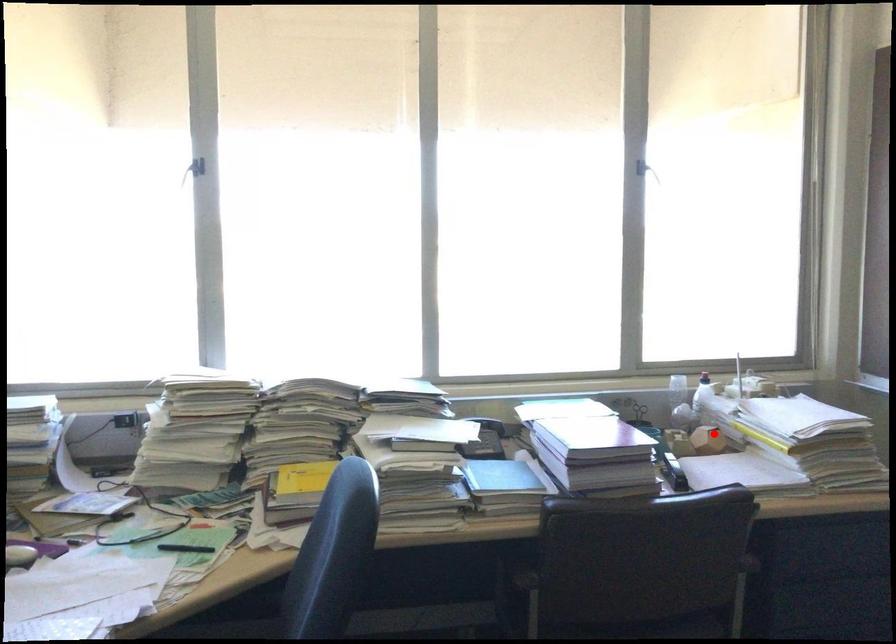
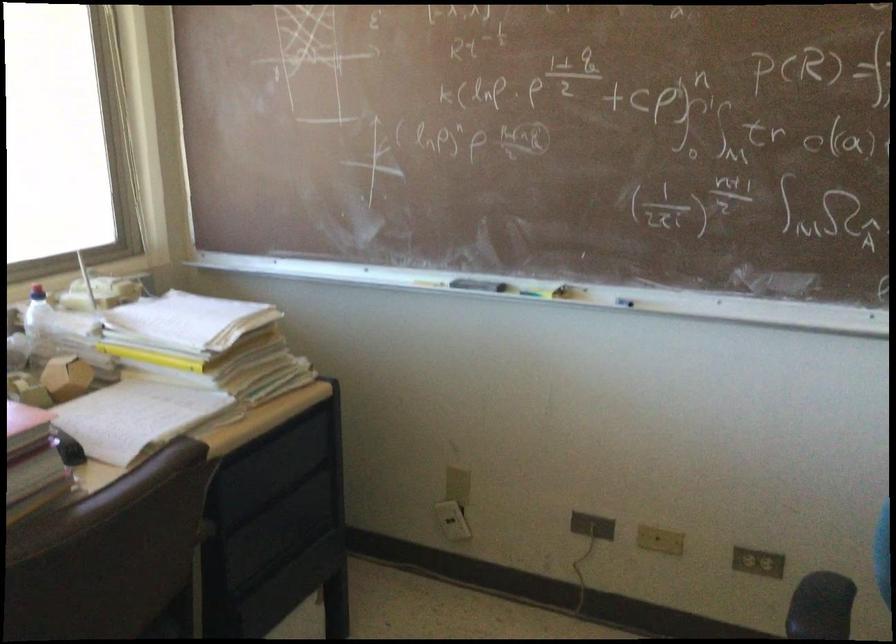
Question: I am providing you with two images of the same scene from different viewpoints. A red point is shown in image1. For the corresponding object point in image2, is it positioned nearer or farther from the camera?

Choices:
 (A) Nearer
 (B) Farther

Answer: (A)